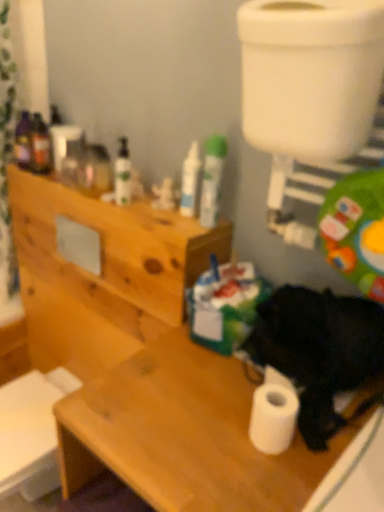
The image size is (384, 512). What are the coordinates of `vacant space positioned to the left of black fur dog at lower right` in the screenshot? It's located at (176, 407).